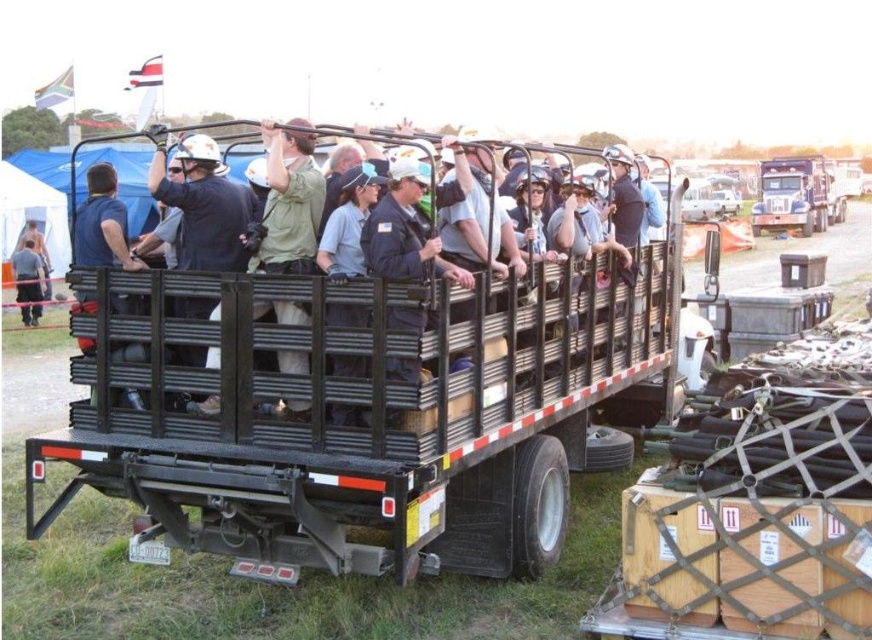
Between point (174, 419) and point (823, 224), which one is positioned in front?

Point (174, 419) is more forward.

Identify the location of black metal trailer truck at center. (363, 410).

Between point (112, 320) and point (784, 177), which one is positioned in front?

Positioned in front is point (112, 320).

Identify the location of black metal trailer truck at center. The height and width of the screenshot is (640, 872). (363, 410).

Does point (290, 477) come behind point (38, 312)?

No, it is not.

Is point (580, 301) closer to camera compared to point (17, 280)?

Yes.

From the picture: Measure the distance between black metal trailer truck at center and camera.

black metal trailer truck at center and camera are 4.18 meters apart.

Where is `black metal trailer truck at center`? The image size is (872, 640). black metal trailer truck at center is located at coordinates (363, 410).

Can you confirm if metallic silver truck at upper right is bigger than dark gray uniform at lower left?

Yes.

Which is more to the left, metallic silver truck at upper right or dark gray uniform at lower left?

dark gray uniform at lower left is more to the left.

Is point (843, 202) positioned behind point (33, 314)?

Yes, point (843, 202) is farther from viewer.

Locate an element on the screen. The width and height of the screenshot is (872, 640). metallic silver truck at upper right is located at coordinates (796, 195).